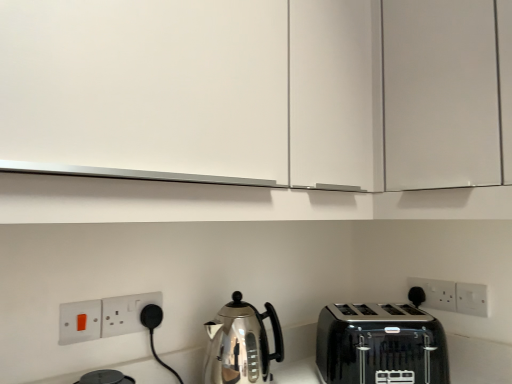
Question: From a real-world perspective, is matte white switch at lower left, the fourth electric outlet positioned from the right, positioned over white matte cabinet at upper center based on gravity?

Choices:
 (A) no
 (B) yes

Answer: (A)

Question: Would you consider matte white switch at lower left, which is the fourth electric outlet from back to front, to be distant from white matte cabinet at upper center?

Choices:
 (A) yes
 (B) no

Answer: (B)

Question: Is matte white switch at lower left, which is the fourth electric outlet from back to front, closer to camera compared to white matte cabinet at upper center?

Choices:
 (A) no
 (B) yes

Answer: (A)

Question: Is matte white switch at lower left, the fourth electric outlet positioned from the right, shorter than white matte cabinet at upper center?

Choices:
 (A) no
 (B) yes

Answer: (B)

Question: Is matte white switch at lower left, which is the fourth electric outlet from back to front, positioned behind white matte cabinet at upper center?

Choices:
 (A) no
 (B) yes

Answer: (B)

Question: Is polished stainless steel kettle at center inside or outside of white plastic socket at lower center, which ranks as the 2th electric outlet in front-to-back order?

Choices:
 (A) outside
 (B) inside

Answer: (A)

Question: Does point (241, 326) appear closer or farther from the camera than point (159, 294)?

Choices:
 (A) farther
 (B) closer

Answer: (B)

Question: Considering the positions of polished stainless steel kettle at center and white plastic socket at lower center, positioned as the 3th electric outlet in back-to-front order, in the image, is polished stainless steel kettle at center wider or thinner than white plastic socket at lower center, positioned as the 3th electric outlet in back-to-front order,?

Choices:
 (A) wide
 (B) thin

Answer: (A)

Question: Visually, is polished stainless steel kettle at center positioned to the left or to the right of white plastic socket at lower center, which ranks as the 2th electric outlet in front-to-back order?

Choices:
 (A) right
 (B) left

Answer: (A)

Question: Based on their sizes in the image, would you say black glossy toaster at lower right is bigger or smaller than white matte cabinet at upper center?

Choices:
 (A) big
 (B) small

Answer: (B)

Question: In terms of width, does black glossy toaster at lower right look wider or thinner when compared to white matte cabinet at upper center?

Choices:
 (A) wide
 (B) thin

Answer: (B)

Question: Is black glossy toaster at lower right situated inside white matte cabinet at upper center or outside?

Choices:
 (A) inside
 (B) outside

Answer: (B)

Question: From the image's perspective, is black glossy toaster at lower right positioned above or below white matte cabinet at upper center?

Choices:
 (A) above
 (B) below

Answer: (B)

Question: Is white matte cabinet at upper center in front of or behind matte white switch at lower left, the fourth electric outlet positioned from the right, in the image?

Choices:
 (A) behind
 (B) front

Answer: (B)

Question: Is white matte cabinet at upper center situated inside matte white switch at lower left, positioned as the first electric outlet in left-to-right order, or outside?

Choices:
 (A) outside
 (B) inside

Answer: (A)